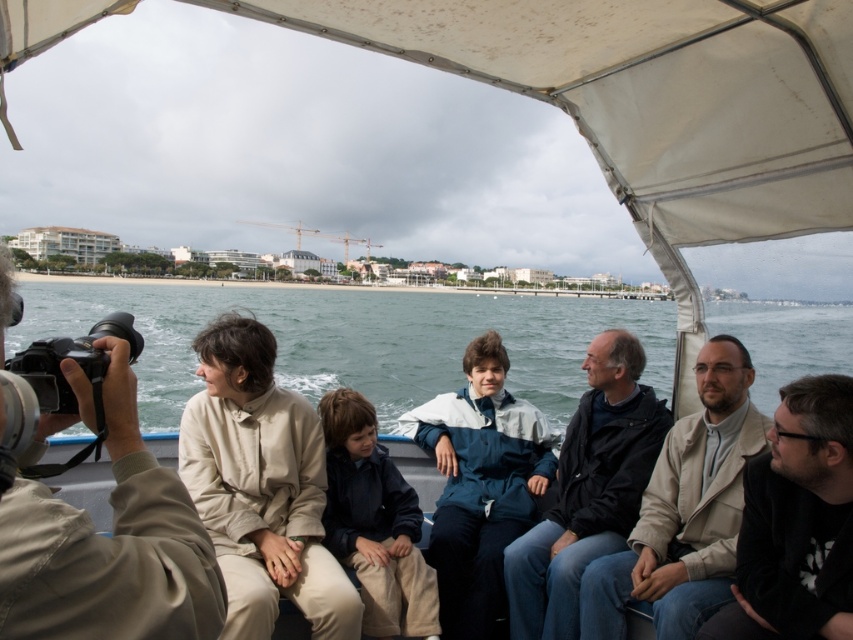
Question: Is beige woolen coat at center to the left of black matte jacket at lower right from the viewer's perspective?

Choices:
 (A) yes
 (B) no

Answer: (A)

Question: Which object is closer to the camera taking this photo?

Choices:
 (A) beige fabric coat at center
 (B) dark blue jacket at center

Answer: (A)

Question: From the image, what is the correct spatial relationship of khaki fabric jacket at left in relation to dark blue jacket at center?

Choices:
 (A) above
 (B) below

Answer: (A)

Question: Which point appears closest to the camera in this image?

Choices:
 (A) (212, 404)
 (B) (164, 595)
 (C) (738, 620)

Answer: (B)

Question: Which is nearer to the beige woolen coat at center?

Choices:
 (A) black matte jacket at lower right
 (B) khaki fabric jacket at left

Answer: (A)

Question: Is beige fabric coat at center above black matte jacket at lower right?

Choices:
 (A) yes
 (B) no

Answer: (A)